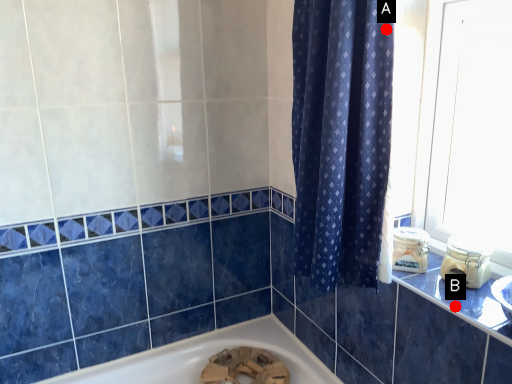
Question: Two points are circled on the image, labeled by A and B beside each circle. Which of the following is the closest to the observer?

Choices:
 (A) A is closer
 (B) B is closer

Answer: (A)